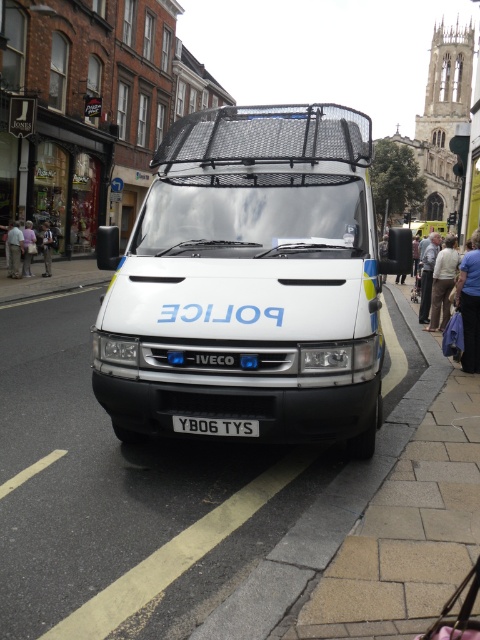
You are a pedestrian standing on the street. You see the white matte police van at center and the light beige pants at lower left. Which object is closer to you?

The light beige pants at lower left are closer to you because they are positioned above the white matte police van at center.